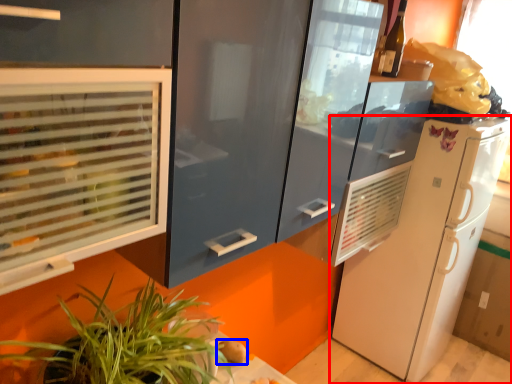
Question: Which point is further to the camera, refrigerator (highlighted by a red box) or food (highlighted by a blue box)?

Choices:
 (A) refrigerator
 (B) food

Answer: (A)